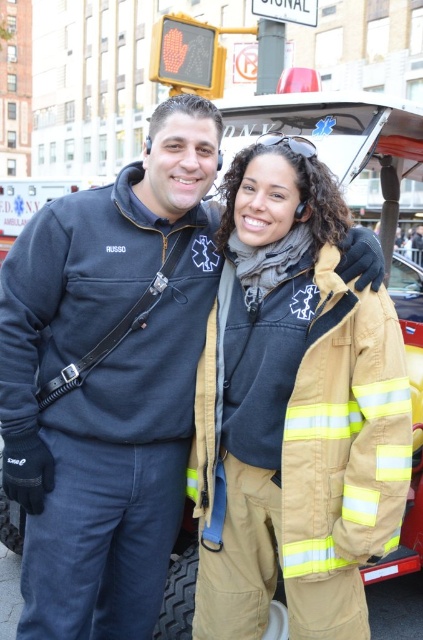
Question: Can you confirm if matte black jacket at center is positioned to the right of tan/yellow reflective fabric at center?

Choices:
 (A) yes
 (B) no

Answer: (B)

Question: Where is matte black jacket at center located in relation to tan/yellow reflective fabric at center in the image?

Choices:
 (A) above
 (B) below

Answer: (A)

Question: Which object appears closest to the camera in this image?

Choices:
 (A) matte black jacket at center
 (B) tan/yellow reflective fabric at center

Answer: (B)

Question: Which point is farther to the camera?

Choices:
 (A) matte black jacket at center
 (B) tan/yellow reflective fabric at center

Answer: (A)

Question: Does matte black jacket at center appear over tan/yellow reflective fabric at center?

Choices:
 (A) yes
 (B) no

Answer: (A)